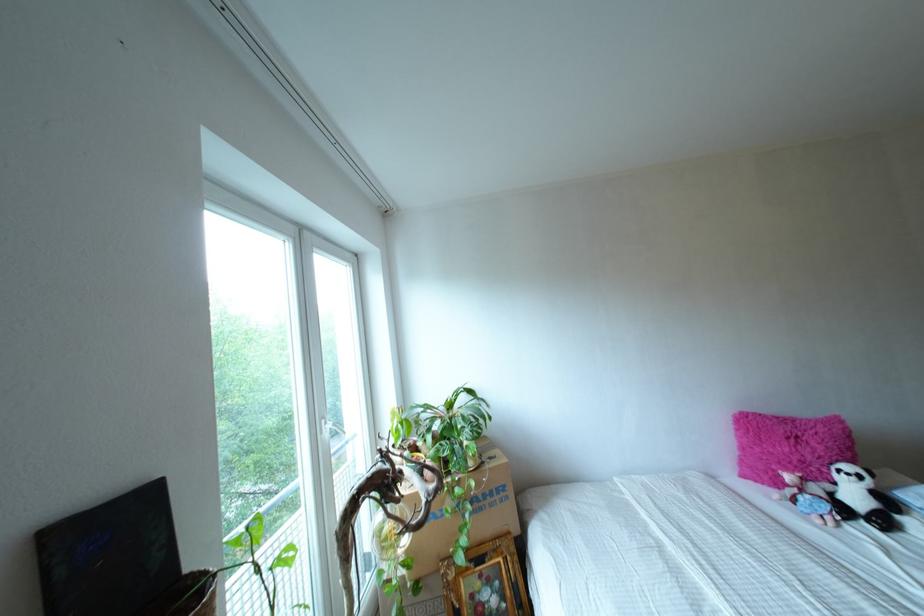
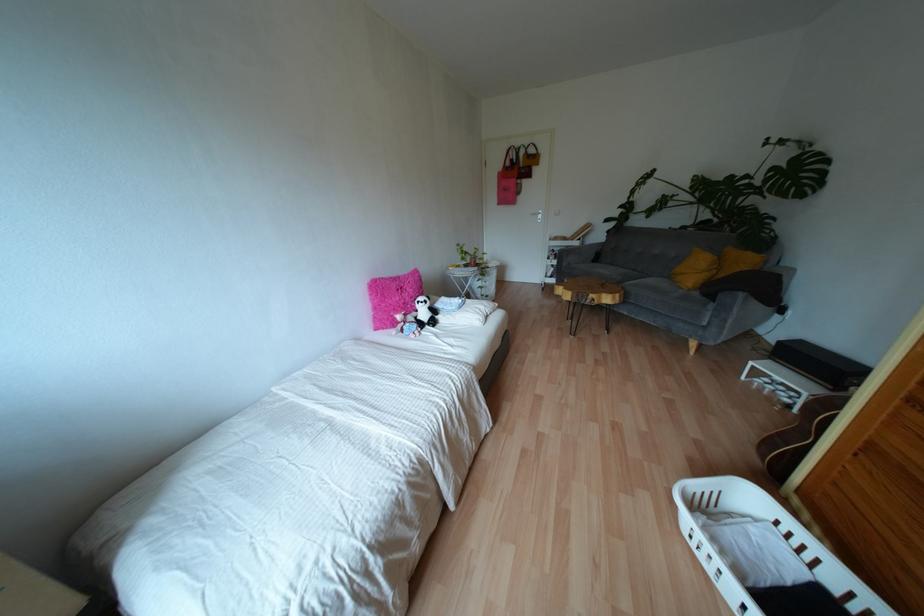
First-person continuous shooting, in which direction is the camera rotating?

The camera's rotation is toward right-down.